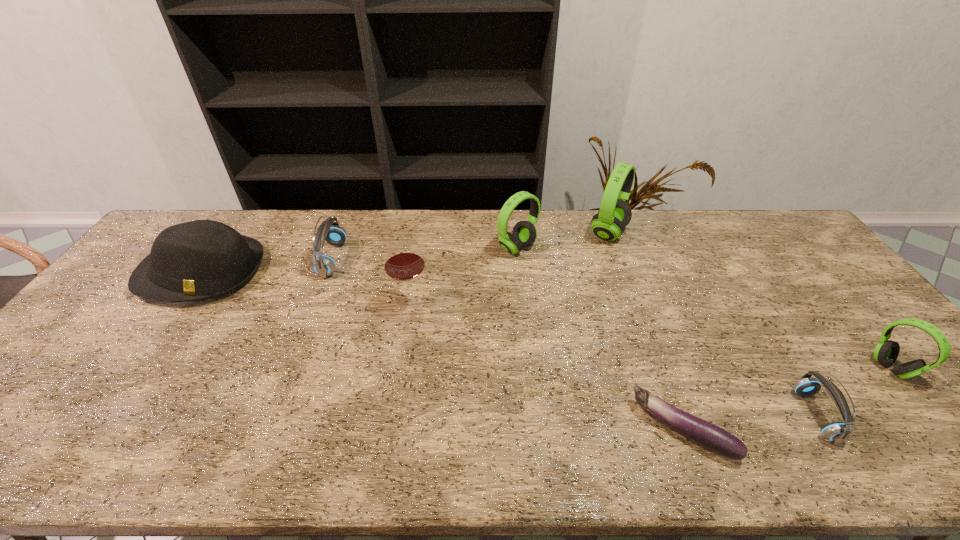
Locate an element on the screen. The image size is (960, 540). object located in the right edge section of the desktop is located at coordinates (886, 352).

The image size is (960, 540). Find the location of `object present at the far left corner`. object present at the far left corner is located at coordinates (198, 260).

Find the location of a particular element. The image size is (960, 540). vacant space at the far edge of the desktop is located at coordinates 254,230.

I want to click on free point at the left edge, so click(153, 307).

Where is `blank space at the right edge of the desktop`? This screenshot has width=960, height=540. blank space at the right edge of the desktop is located at coordinates (889, 378).

This screenshot has height=540, width=960. In the image, there is a desktop. Identify the location of vacant space at the far left corner. (195, 219).

I want to click on vacant space at the far right corner, so click(761, 241).

Where is `free space between the tallest object and the wineglass`? free space between the tallest object and the wineglass is located at coordinates (509, 269).

Find the location of a particular element. vacant area that lies between the rightmost green headset and the eggplant is located at coordinates (787, 399).

This screenshot has height=540, width=960. I want to click on vacant area that lies between the second headset from right to left and the second object from left to right, so click(x=573, y=338).